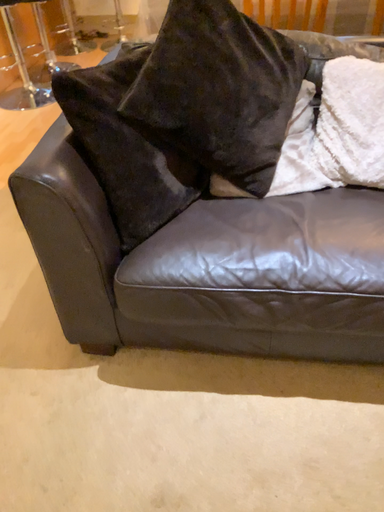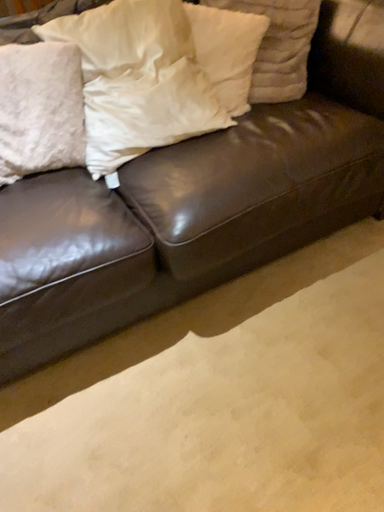
Question: Which way did the camera rotate in the video?

Choices:
 (A) rotated right
 (B) rotated left

Answer: (A)